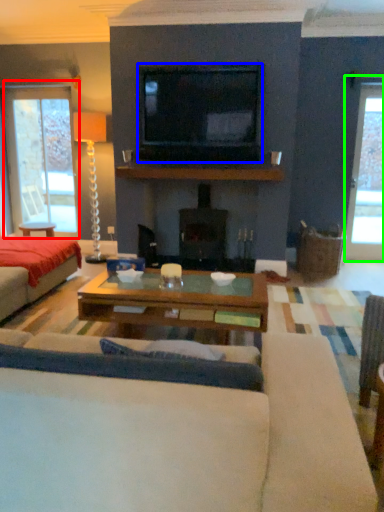
Question: Which object is the closest to the window (highlighted by a red box)? Choose among these: television (highlighted by a blue box) or window (highlighted by a green box).

Choices:
 (A) television
 (B) window

Answer: (A)